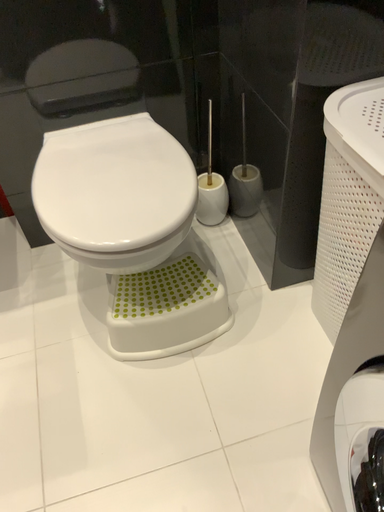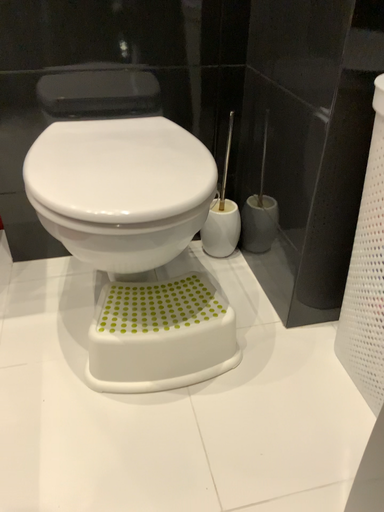
Question: Which way did the camera rotate in the video?

Choices:
 (A) rotated upward
 (B) rotated downward

Answer: (A)